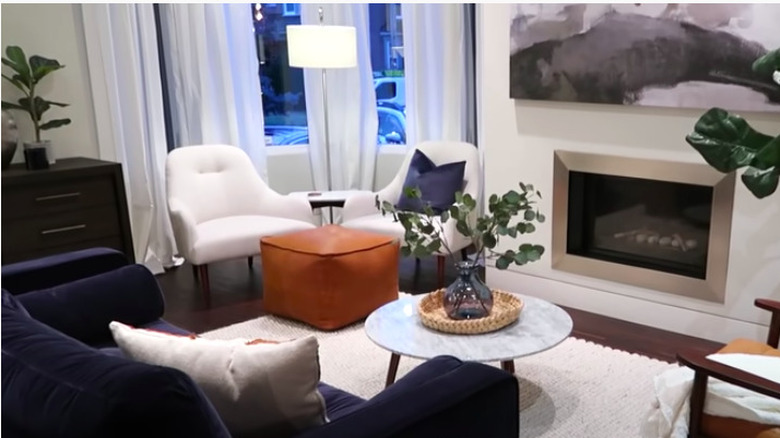
I want to click on curtains, so click(x=137, y=50), click(x=211, y=48), click(x=360, y=88), click(x=431, y=92).